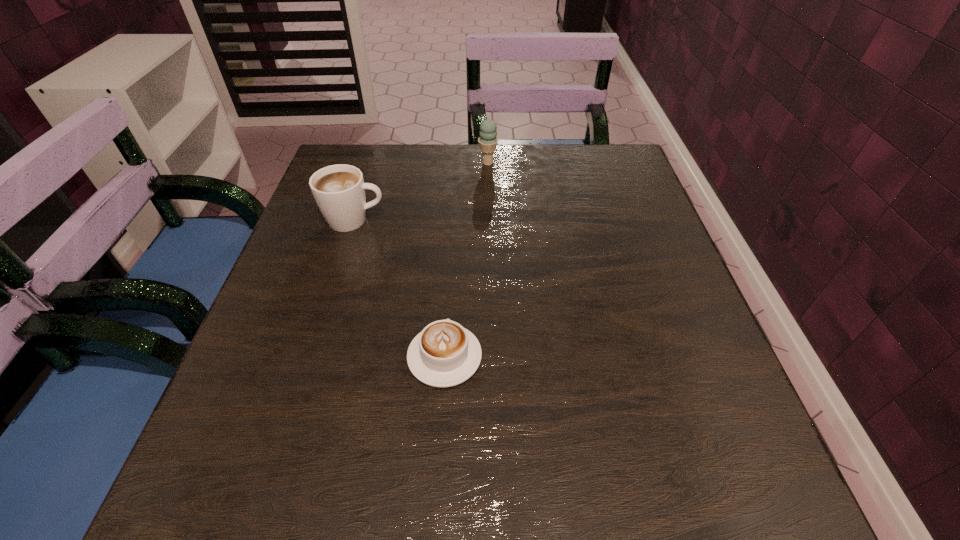
This screenshot has height=540, width=960. What are the coordinates of `blank region between the ice cream and the farther cappuccino` in the screenshot? It's located at (421, 192).

Where is `empty location between the leftmost object and the shortest object`? The image size is (960, 540). empty location between the leftmost object and the shortest object is located at coordinates (399, 288).

At what (x,y) coordinates should I click in order to perform the action: click on vacant space that's between the shortest object and the ice cream. Please return your answer as a coordinate pair (x, y). Looking at the image, I should click on (467, 260).

The height and width of the screenshot is (540, 960). Find the location of `free space between the left cappuccino and the nearer cappuccino`. free space between the left cappuccino and the nearer cappuccino is located at coordinates (399, 288).

Find the location of a particular element. free spot between the taller cappuccino and the ice cream is located at coordinates (421, 192).

Where is `vacant space in between the shorter cappuccino and the ice cream`? vacant space in between the shorter cappuccino and the ice cream is located at coordinates (467, 260).

Find the location of `free space between the ice cream and the left cappuccino`. free space between the ice cream and the left cappuccino is located at coordinates (421, 192).

Select which object appears as the closest to the nearest object. Please provide its 2D coordinates. Your answer should be formatted as a tuple, i.e. [(x, y)], where the tuple contains the x and y coordinates of a point satisfying the conditions above.

[(339, 190)]

In order to click on object that can be found as the closest to the right cappuccino in this screenshot , I will do `click(339, 190)`.

Find the location of a particular element. The image size is (960, 540). free location that satisfies the following two spatial constraints: 1. with the handle on the right side of the ice cream; 2. on the left side of the nearest object is located at coordinates (457, 163).